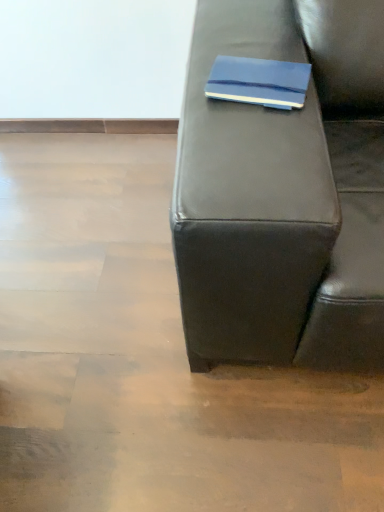
Locate an element on the screen. blue matte notebook at upper center is located at coordinates (259, 82).

This screenshot has height=512, width=384. Describe the element at coordinates (259, 82) in the screenshot. I see `blue matte notebook at upper center` at that location.

Where is `matte black couch at center`? matte black couch at center is located at coordinates (284, 192).

This screenshot has height=512, width=384. Describe the element at coordinates (284, 192) in the screenshot. I see `matte black couch at center` at that location.

Identify the location of blue matte notebook at upper center. (259, 82).

Between matte black couch at center and blue matte notebook at upper center, which one appears on the right side from the viewer's perspective?

Positioned to the right is blue matte notebook at upper center.

Considering the relative positions of matte black couch at center and blue matte notebook at upper center in the image provided, is matte black couch at center in front of blue matte notebook at upper center?

Yes, matte black couch at center is closer to the viewer.

Which is closer, (228, 268) or (250, 99)?

Clearly, point (228, 268) is closer to the camera than point (250, 99).

From the image's perspective, which object appears higher, matte black couch at center or blue matte notebook at upper center?

blue matte notebook at upper center is shown above in the image.

From a real-world perspective, who is located lower, matte black couch at center or blue matte notebook at upper center?

From a 3D spatial view, matte black couch at center is below.

Looking at their sizes, would you say matte black couch at center is wider or thinner than blue matte notebook at upper center?

In the image, matte black couch at center appears to be wider than blue matte notebook at upper center.

Is matte black couch at center taller or shorter than blue matte notebook at upper center?

Clearly, matte black couch at center is taller compared to blue matte notebook at upper center.

Does matte black couch at center have a smaller size compared to blue matte notebook at upper center?

No, matte black couch at center is not smaller than blue matte notebook at upper center.

Would you say blue matte notebook at upper center is part of matte black couch at center's contents?

No, matte black couch at center does not contain blue matte notebook at upper center.

Are matte black couch at center and blue matte notebook at upper center far apart?

No.

Could you tell me if matte black couch at center is facing blue matte notebook at upper center?

No, matte black couch at center is not aimed at blue matte notebook at upper center.

What's the angular difference between matte black couch at center and blue matte notebook at upper center's facing directions?

The angular difference between matte black couch at center and blue matte notebook at upper center is 10.8 degrees.

Find the location of a particular element. studio couch located underneath the blue matte notebook at upper center (from a real-world perspective) is located at coordinates (284, 192).

Between blue matte notebook at upper center and matte black couch at center, which one appears on the right side from the viewer's perspective?

From the viewer's perspective, blue matte notebook at upper center appears more on the right side.

Considering the positions of objects blue matte notebook at upper center and matte black couch at center in the image provided, who is behind, blue matte notebook at upper center or matte black couch at center?

blue matte notebook at upper center is more distant.

Between point (276, 78) and point (337, 17), which one is positioned in front?

The point (276, 78) is more forward.

From the image's perspective, who appears lower, blue matte notebook at upper center or matte black couch at center?

matte black couch at center appears lower in the image.

From a real-world perspective, is blue matte notebook at upper center positioned above or below matte black couch at center?

Clearly, from a real-world perspective, blue matte notebook at upper center is above matte black couch at center.

Does blue matte notebook at upper center have a lesser width compared to matte black couch at center?

Yes.

Can you confirm if blue matte notebook at upper center is taller than matte black couch at center?

No, blue matte notebook at upper center is not taller than matte black couch at center.

Is blue matte notebook at upper center smaller than matte black couch at center?

Indeed, blue matte notebook at upper center has a smaller size compared to matte black couch at center.

Does blue matte notebook at upper center contain matte black couch at center?

No.

Would you consider blue matte notebook at upper center to be distant from matte black couch at center?

No.

Is blue matte notebook at upper center aimed at matte black couch at center?

No, blue matte notebook at upper center does not turn towards matte black couch at center.

Where is `studio couch below the blue matte notebook at upper center (from a real-world perspective)`? The image size is (384, 512). studio couch below the blue matte notebook at upper center (from a real-world perspective) is located at coordinates (284, 192).

Find the location of a particular element. Image resolution: width=384 pixels, height=512 pixels. paperback book above the matte black couch at center (from a real-world perspective) is located at coordinates (259, 82).

The image size is (384, 512). Identify the location of paperback book behind the matte black couch at center. (259, 82).